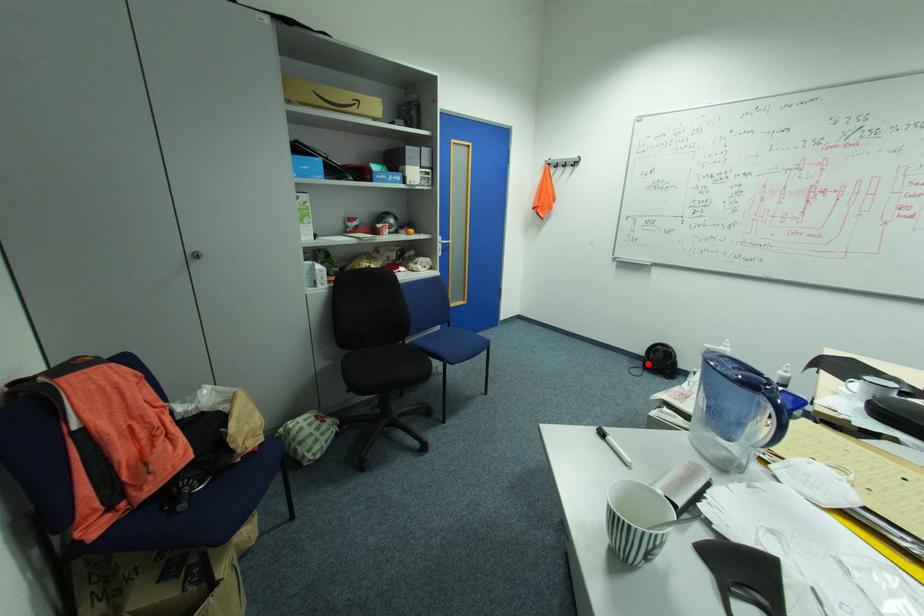
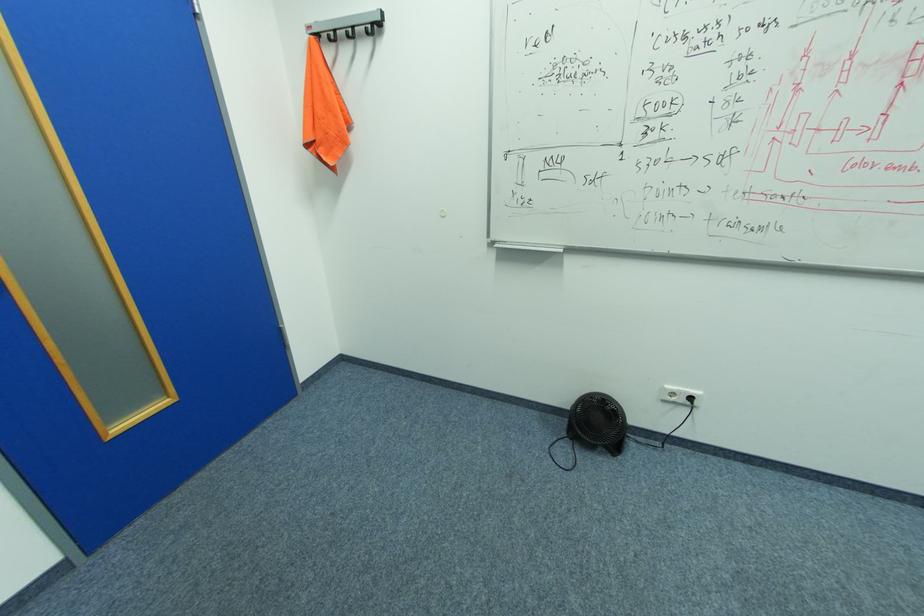
Locate, in the second image, the point that corresponds to the highlighted location in the first image.

(568, 423)